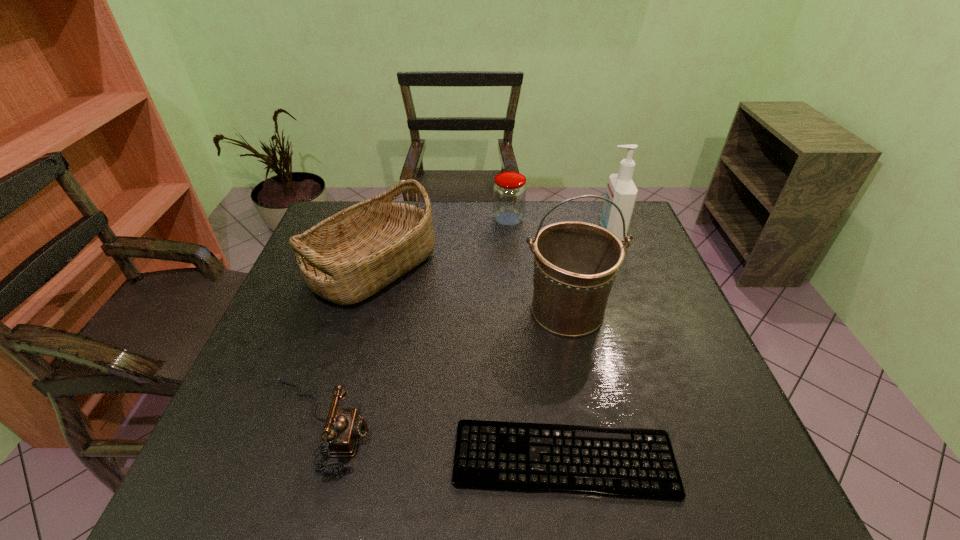
Choose which object is the second nearest neighbor to the cleansing agent. Please provide its 2D coordinates. Your answer should be formatted as a tuple, i.e. [(x, y)], where the tuple contains the x and y coordinates of a point satisfying the conditions above.

[(509, 191)]